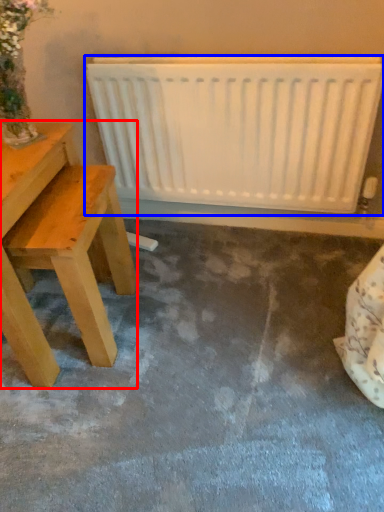
Question: Which object appears closest to the camera in this image, table (highlighted by a red box) or radiator (highlighted by a blue box)?

Choices:
 (A) table
 (B) radiator

Answer: (A)